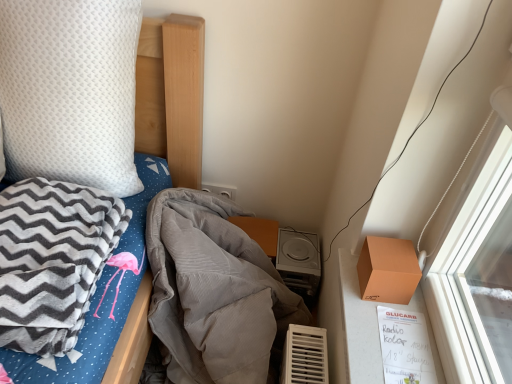
The width and height of the screenshot is (512, 384). Describe the element at coordinates (70, 91) in the screenshot. I see `white textured pillow at upper left` at that location.

Where is `silver metallic stereo at lower center`? silver metallic stereo at lower center is located at coordinates point(298,261).

Locate an element on the screen. The width and height of the screenshot is (512, 384). power plugs and sockets below the orange matte box at right (from a real-world perspective) is located at coordinates (221, 190).

Is white plastic power plugs and sockets at upper center at the back of orange matte box at right?

That's not correct — orange matte box at right is not looking away from white plastic power plugs and sockets at upper center.

Can you tell me how much orange matte box at right and white plastic power plugs and sockets at upper center differ in facing direction?

They differ by 90.8 degrees in their facing directions.

From a real-world perspective, does orange matte box at right sit lower than white plastic power plugs and sockets at upper center?

No, from a real-world perspective, orange matte box at right is not beneath white plastic power plugs and sockets at upper center.

Is white textured pillow at upper left taller or shorter than gray corduroy blanket at center, marked as the second blanket in a left-to-right arrangement?

white textured pillow at upper left is shorter than gray corduroy blanket at center, marked as the second blanket in a left-to-right arrangement.

Is white textured pillow at upper left beside gray corduroy blanket at center, marked as the first blanket in a right-to-left arrangement?

white textured pillow at upper left is not next to gray corduroy blanket at center, marked as the first blanket in a right-to-left arrangement, and they're not touching.

From the image's perspective, between white textured pillow at upper left and gray corduroy blanket at center, marked as the second blanket in a left-to-right arrangement, which one is located above?

white textured pillow at upper left appears higher in the image.

From a real-world perspective, which object stands above the other?

From a 3D spatial view, white textured pillow at upper left is above.

Considering the relative positions of white textured pillow at upper left and white plastic power plugs and sockets at upper center in the image provided, is white textured pillow at upper left to the left or to the right of white plastic power plugs and sockets at upper center?

white textured pillow at upper left is positioned on white plastic power plugs and sockets at upper center's left side.

Consider the image. Considering the sizes of objects white textured pillow at upper left and white plastic power plugs and sockets at upper center in the image provided, who is shorter, white textured pillow at upper left or white plastic power plugs and sockets at upper center?

white plastic power plugs and sockets at upper center is shorter.

Is white textured pillow at upper left placed right next to white plastic power plugs and sockets at upper center?

No, white textured pillow at upper left is not making contact with white plastic power plugs and sockets at upper center.

How different are the orientations of silver metallic stereo at lower center and white textured pillow at upper left in degrees?

1.34 degrees separate the facing orientations of silver metallic stereo at lower center and white textured pillow at upper left.

Where is `pillow that is on the left side of silver metallic stereo at lower center`? This screenshot has height=384, width=512. pillow that is on the left side of silver metallic stereo at lower center is located at coordinates (70, 91).

Would you say silver metallic stereo at lower center is outside white textured pillow at upper left?

silver metallic stereo at lower center lies outside white textured pillow at upper left's area.

Is silver metallic stereo at lower center bigger than white textured pillow at upper left?

No, silver metallic stereo at lower center is not bigger than white textured pillow at upper left.

Can you confirm if gray fleece blanket at left, the 1th blanket when ordered from left to right, is positioned to the left of white textured pillow at upper left?

No, gray fleece blanket at left, the 1th blanket when ordered from left to right, is not to the left of white textured pillow at upper left.

Which point is more forward, (105, 228) or (122, 64)?

The point (105, 228) is closer to the camera.

In the scene shown: Considering the sizes of objects gray fleece blanket at left, the second blanket in the right-to-left sequence, and white textured pillow at upper left in the image provided, who is shorter, gray fleece blanket at left, the second blanket in the right-to-left sequence, or white textured pillow at upper left?

Standing shorter between the two is gray fleece blanket at left, the second blanket in the right-to-left sequence.

Does gray fleece blanket at left, the second blanket in the right-to-left sequence, have a greater width compared to white textured pillow at upper left?

Correct, the width of gray fleece blanket at left, the second blanket in the right-to-left sequence, exceeds that of white textured pillow at upper left.

From the picture: How many degrees apart are the facing directions of gray corduroy blanket at center, marked as the second blanket in a left-to-right arrangement, and gray fleece blanket at left, the 1th blanket when ordered from left to right?

The angular difference between gray corduroy blanket at center, marked as the second blanket in a left-to-right arrangement, and gray fleece blanket at left, the 1th blanket when ordered from left to right, is 0.376 degrees.

Is the depth of gray corduroy blanket at center, marked as the first blanket in a right-to-left arrangement, less than that of gray fleece blanket at left, the 1th blanket when ordered from left to right?

No, gray corduroy blanket at center, marked as the first blanket in a right-to-left arrangement, is further to the viewer.

From the image's perspective, relative to gray fleece blanket at left, the second blanket in the right-to-left sequence, is gray corduroy blanket at center, marked as the first blanket in a right-to-left arrangement, above or below?

Clearly, from the image's perspective, gray corduroy blanket at center, marked as the first blanket in a right-to-left arrangement, is below gray fleece blanket at left, the second blanket in the right-to-left sequence.

From a real-world perspective, is gray corduroy blanket at center, marked as the second blanket in a left-to-right arrangement, located beneath gray fleece blanket at left, the 1th blanket when ordered from left to right?

Yes, from a real-world perspective, gray corduroy blanket at center, marked as the second blanket in a left-to-right arrangement, is below gray fleece blanket at left, the 1th blanket when ordered from left to right.

Looking at this image, is white plastic power plugs and sockets at upper center at the back of silver metallic stereo at lower center?

No, silver metallic stereo at lower center is not facing the opposite direction of white plastic power plugs and sockets at upper center.

Identify the location of power plugs and sockets above the silver metallic stereo at lower center (from a real-world perspective). The height and width of the screenshot is (384, 512). (221, 190).

From a real-world perspective, who is located lower, silver metallic stereo at lower center or white plastic power plugs and sockets at upper center?

In real-world perspective, silver metallic stereo at lower center is lower.

Is silver metallic stereo at lower center placed right next to white plastic power plugs and sockets at upper center?

silver metallic stereo at lower center and white plastic power plugs and sockets at upper center are clearly separated.

Identify the location of box on the right of white plastic power plugs and sockets at upper center. coord(388,270).

At what (x,y) coordinates should I click in order to perform the action: click on the 2nd blanket below the white textured pillow at upper left (from the image's perspective). Please return your answer as a coordinate pair (x, y). Looking at the image, I should click on click(x=214, y=292).

When comparing their distances from silver metallic stereo at lower center, does white textured pillow at upper left or white plastic power plugs and sockets at upper center seem closer?

white plastic power plugs and sockets at upper center is positioned closer to the anchor silver metallic stereo at lower center.

Looking at the image, which one is located closer to gray fleece blanket at left, the second blanket in the right-to-left sequence, white textured pillow at upper left or orange matte box at right?

Among the two, white textured pillow at upper left is located nearer to gray fleece blanket at left, the second blanket in the right-to-left sequence.

Estimate the real-world distances between objects in this image. Which object is further from gray corduroy blanket at center, marked as the first blanket in a right-to-left arrangement, white textured pillow at upper left or orange matte box at right?

orange matte box at right lies further to gray corduroy blanket at center, marked as the first blanket in a right-to-left arrangement, than the other object.

In the scene shown: From the image, which object appears to be nearer to gray corduroy blanket at center, marked as the first blanket in a right-to-left arrangement, white textured pillow at upper left or gray fleece blanket at left, the 1th blanket when ordered from left to right?

The object closer to gray corduroy blanket at center, marked as the first blanket in a right-to-left arrangement, is gray fleece blanket at left, the 1th blanket when ordered from left to right.

Which object lies further to the anchor point gray fleece blanket at left, the second blanket in the right-to-left sequence, white plastic power plugs and sockets at upper center or white textured pillow at upper left?

white plastic power plugs and sockets at upper center lies further to gray fleece blanket at left, the second blanket in the right-to-left sequence, than the other object.

Looking at the image, which one is located further to silver metallic stereo at lower center, white textured pillow at upper left or gray fleece blanket at left, the 1th blanket when ordered from left to right?

white textured pillow at upper left is positioned further to the anchor silver metallic stereo at lower center.

Which object lies further to the anchor point orange matte box at right, white plastic power plugs and sockets at upper center or silver metallic stereo at lower center?

Based on the image, white plastic power plugs and sockets at upper center appears to be further to orange matte box at right.

From the picture: Which object lies further to the anchor point white plastic power plugs and sockets at upper center, gray corduroy blanket at center, marked as the second blanket in a left-to-right arrangement, or orange matte box at right?

orange matte box at right is positioned further to the anchor white plastic power plugs and sockets at upper center.

Identify the location of blanket between gray fleece blanket at left, the second blanket in the right-to-left sequence, and silver metallic stereo at lower center, along the z-axis. (214, 292).

Find the location of a particular element. This screenshot has height=384, width=512. stereo situated between gray fleece blanket at left, the second blanket in the right-to-left sequence, and orange matte box at right from left to right is located at coordinates (298, 261).

Find the location of a particular element. pillow positioned between gray corduroy blanket at center, marked as the first blanket in a right-to-left arrangement, and white plastic power plugs and sockets at upper center from near to far is located at coordinates click(x=70, y=91).

What are the coordinates of `blanket between gray fleece blanket at left, the 1th blanket when ordered from left to right, and white plastic power plugs and sockets at upper center, along the z-axis` in the screenshot? It's located at (214, 292).